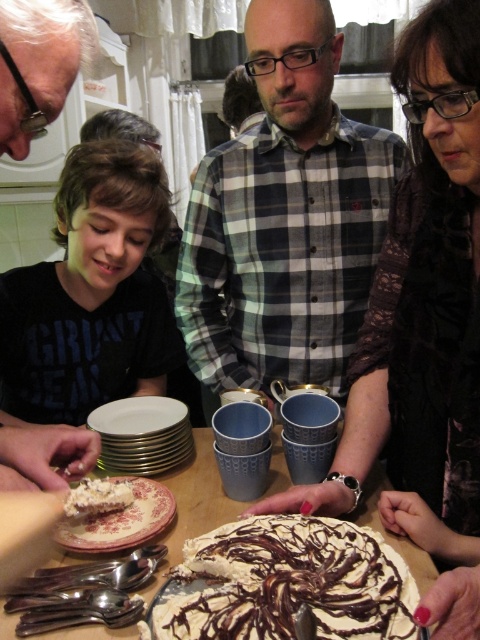
You are standing at a table with two points marked. The first point is at coordinate (300,188) and the second is at (427,556). Which point is closer to you?

Point (300,188) is closer to you because it is further to the camera than point (427,556).

You are a guest at this gathering and want to grab a slice of cake. Since the matte black shirt at center is in the way, can you easily reach the cake on the white ceramic table at center without moving the shirt?

The matte black shirt at center is not as tall as the white ceramic table at center, so you can easily reach over the matte black shirt at center to grab the cake on the white ceramic table at center.